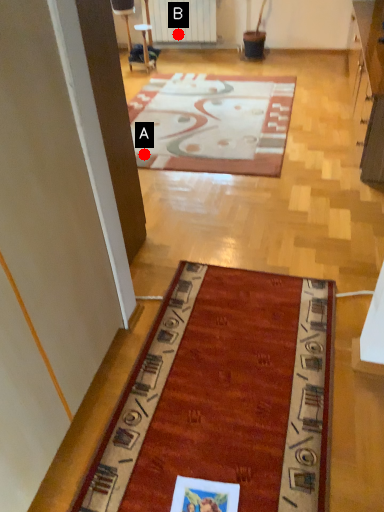
Question: Two points are circled on the image, labeled by A and B beside each circle. Among these points, which one is farthest from the camera?

Choices:
 (A) A is further
 (B) B is further

Answer: (B)